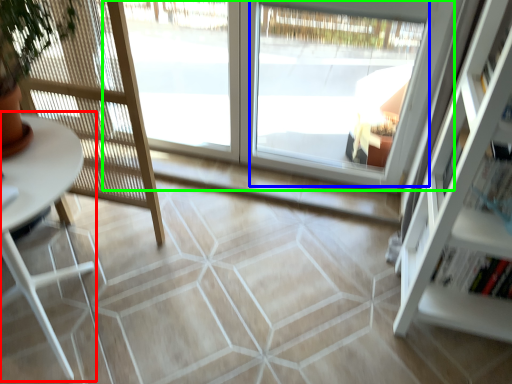
Question: Which object is positioned farthest from table (highlighted by a red box)? Select from window (highlighted by a blue box) and window (highlighted by a green box).

Choices:
 (A) window
 (B) window

Answer: (A)